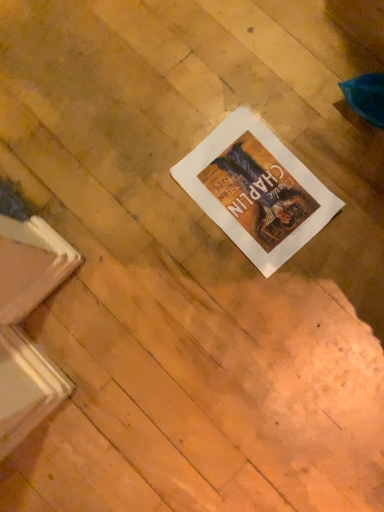
Where is `white paper at center`? Image resolution: width=384 pixels, height=512 pixels. white paper at center is located at coordinates (256, 190).

The image size is (384, 512). What do you see at coordinates (256, 190) in the screenshot?
I see `white paper at center` at bounding box center [256, 190].

Identify the location of white paper at center. (256, 190).